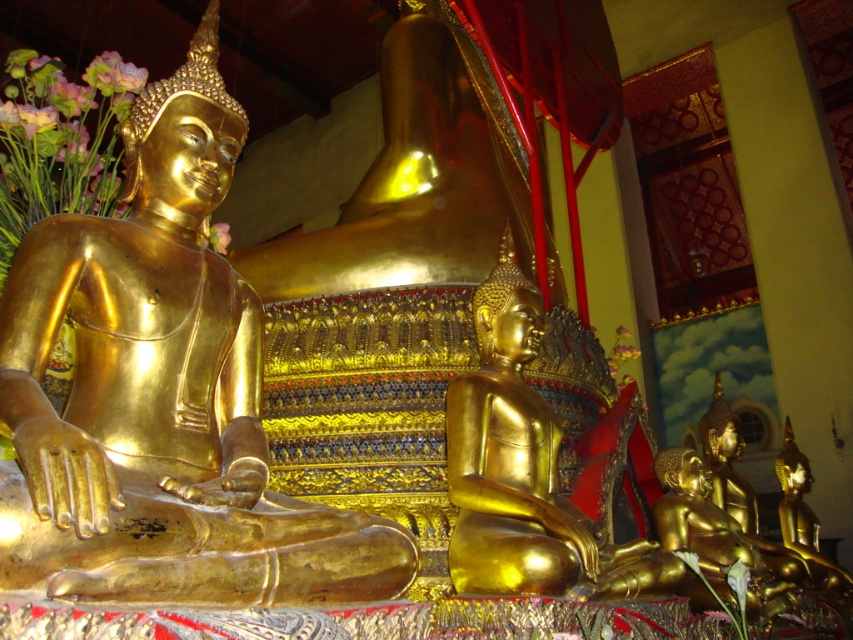
You are a temple visitor standing in front of the gold polished statue at center and the gold shiny statue at center. You want to know the distance between them to decide if you can take a photo that captures both in one frame. Can you fit both statues in your camera view if your camera has a maximum viewing range of 15 meters?

The gold polished statue at center is 15.65 meters away from the gold shiny statue at center. Since the distance exceeds the camera maximum viewing range of 15 meters, you cannot capture both statues in one frame.

You are standing in front of the temple and see the gold polished statue at center and the gold shiny statue at center. Which one is positioned to the left side?

The gold polished statue at center is positioned to the left of the gold shiny statue at center.